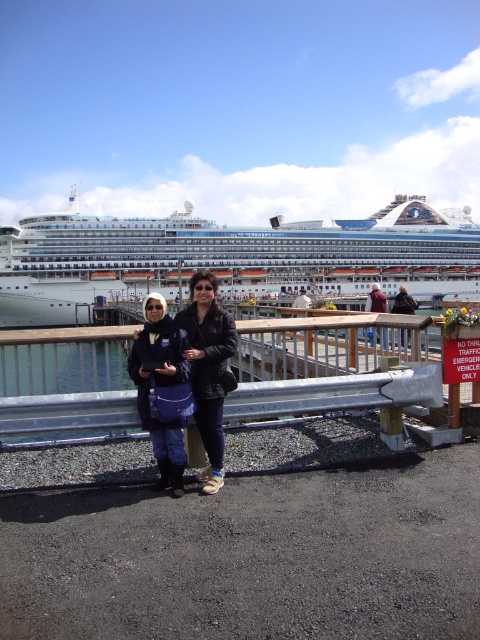
Between metal/rustic rail at center and black leather jacket at center, which one has more height?

black leather jacket at center is taller.

Which of these two, metal/rustic rail at center or black leather jacket at center, stands shorter?

metal/rustic rail at center

Describe the element at coordinates (330, 364) in the screenshot. Image resolution: width=480 pixels, height=640 pixels. I see `metal/rustic rail at center` at that location.

You are a GUI agent. You are given a task and a screenshot of the screen. Output one action in this format:
    pyautogui.click(x=<x>, y=<y>)
    Task: Click on the metal/rustic rail at center
    Image resolution: width=480 pixels, height=640 pixels.
    Given the screenshot: What is the action you would take?
    pyautogui.click(x=330, y=364)

Can you confirm if metal/rustic rail at center is positioned to the left of blue denim jacket at center?

No, metal/rustic rail at center is not to the left of blue denim jacket at center.

In order to click on metal/rustic rail at center in this screenshot , I will do `click(330, 364)`.

Who is more forward, (x=239, y=330) or (x=171, y=467)?

Point (x=171, y=467) is in front.

Identify the location of metal/rustic rail at center. (330, 364).

Does point (333, 268) come closer to viewer compared to point (144, 340)?

That is False.

Which is more to the right, white glossy cruise ship at upper center or blue denim jacket at center?

From the viewer's perspective, white glossy cruise ship at upper center appears more on the right side.

The image size is (480, 640). Describe the element at coordinates (230, 257) in the screenshot. I see `white glossy cruise ship at upper center` at that location.

Locate an element on the screen. The image size is (480, 640). white glossy cruise ship at upper center is located at coordinates click(x=230, y=257).